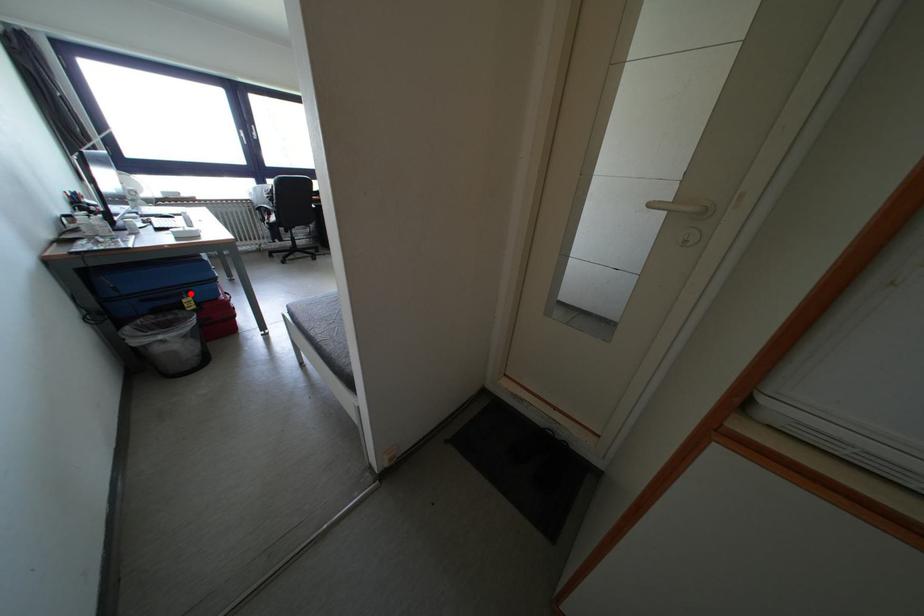
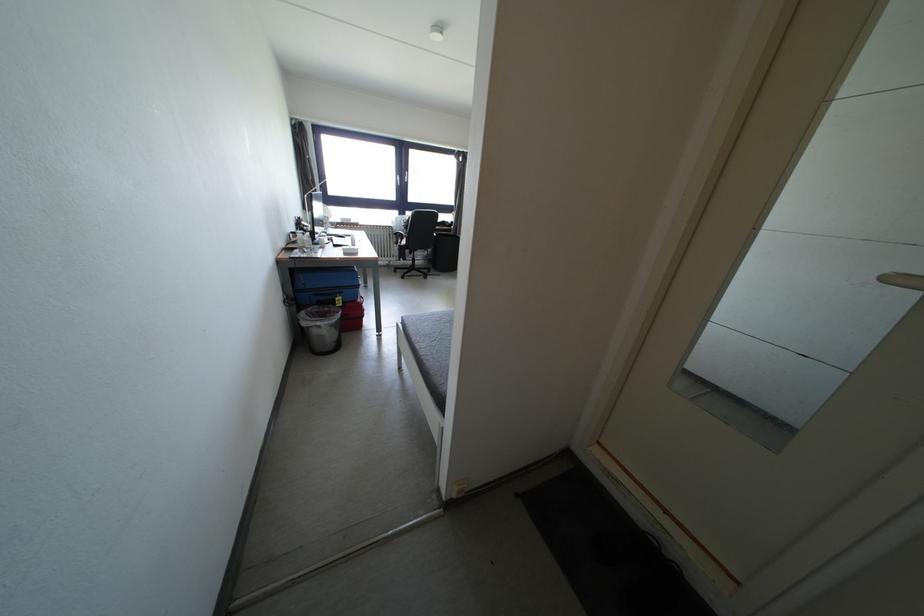
Find the pixel in the second image that matches the highlighted location in the first image.

(345, 294)